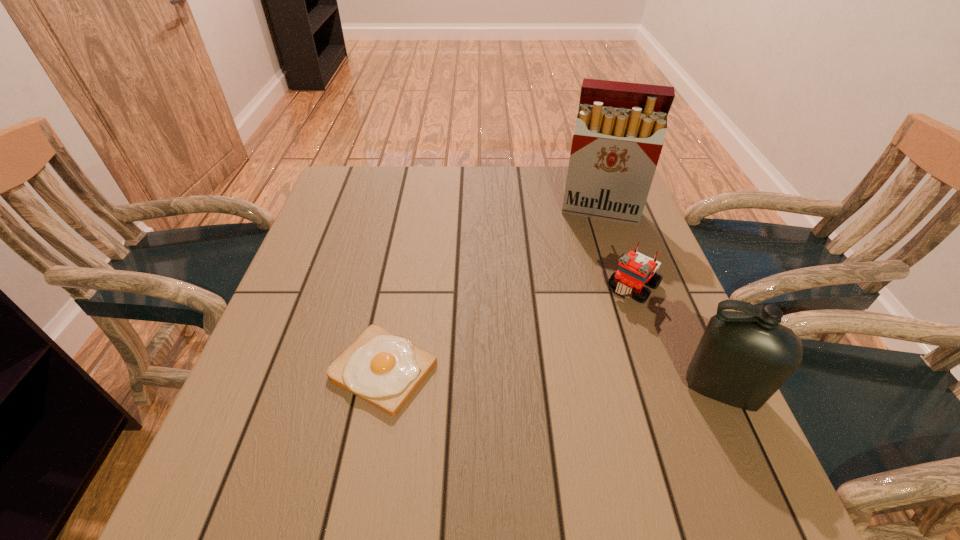
At what (x,y) coordinates should I click in order to perform the action: click on vacant space on the desktop that is between the leftmost object and the bottle and is positioned with the lid open on the cigarette case. Please return your answer as a coordinate pair (x, y). The image size is (960, 540). Looking at the image, I should click on (579, 382).

The image size is (960, 540). I want to click on vacant space on the desktop that is between the shortest object and the second tallest object and is positioned on the front-facing side of the Lego, so click(x=551, y=380).